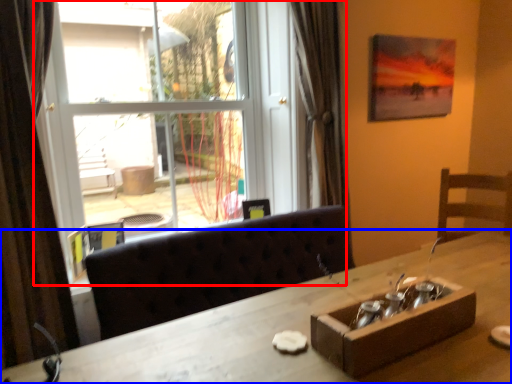
Question: Which object appears farthest to the camera in this image, window (highlighted by a red box) or desk (highlighted by a blue box)?

Choices:
 (A) window
 (B) desk

Answer: (A)